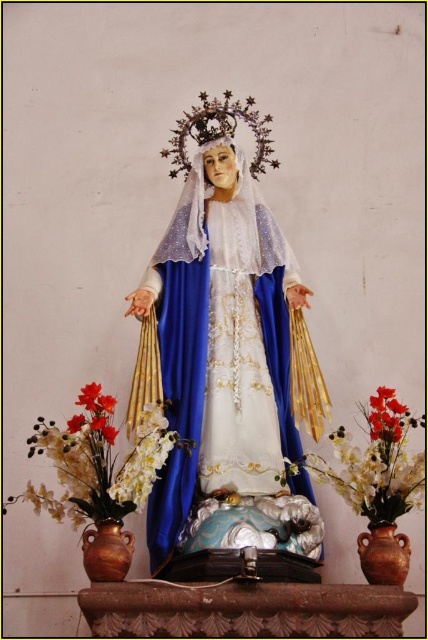
Question: Does matte white statue at center have a larger size compared to brown earthenware vase at lower right?

Choices:
 (A) yes
 (B) no

Answer: (A)

Question: Considering the real-world distances, which object is farthest from the brown earthenware vase at lower left?

Choices:
 (A) silky white petals at lower center
 (B) brown earthenware vase at lower right
 (C) white artificial flowers at lower left
 (D) matte white statue at center

Answer: (B)

Question: Estimate the real-world distances between objects in this image. Which object is farther from the brown earthenware vase at lower right?

Choices:
 (A) white artificial flowers at lower left
 (B) matte white statue at center
 (C) silky white petals at lower center

Answer: (A)

Question: Which of the following is the closest to the observer?

Choices:
 (A) (119, 563)
 (B) (380, 484)
 (C) (154, 417)
 (D) (300, 499)

Answer: (A)

Question: Does white artificial flowers at lower left appear on the left side of brown earthenware vase at lower left?

Choices:
 (A) no
 (B) yes

Answer: (B)

Question: Is matte white statue at center below silky white petals at lower center?

Choices:
 (A) no
 (B) yes

Answer: (A)